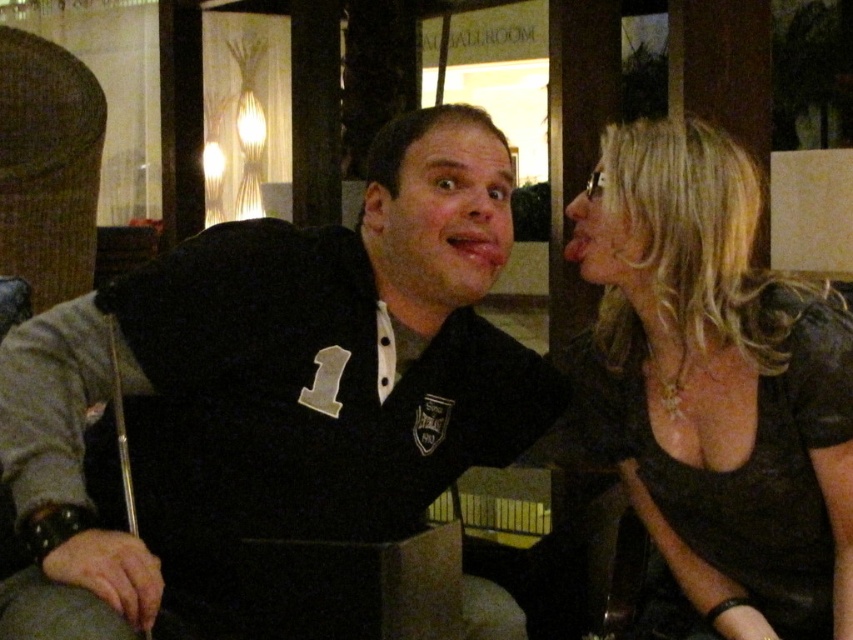
You are a photographer at the event and need to capture a photo of both the black jersey at center and the shiny black dress at right. Based on their positions, which one should you focus on first to ensure both are in frame?

The black jersey at center is positioned on the left side of shiny black dress at right, so you should focus on the shiny black dress at right first to ensure both are in frame.

You are a photographer at the event and want to capture a full body shot of both the black jersey at center and the shiny black dress at right. Given their lengths, which one might require you to adjust your camera angle to avoid cropping the bottom of the image?

The shiny black dress at right is longer than the black jersey at center, so you might need to adjust the camera angle to avoid cropping the bottom of the shiny black dress at right.